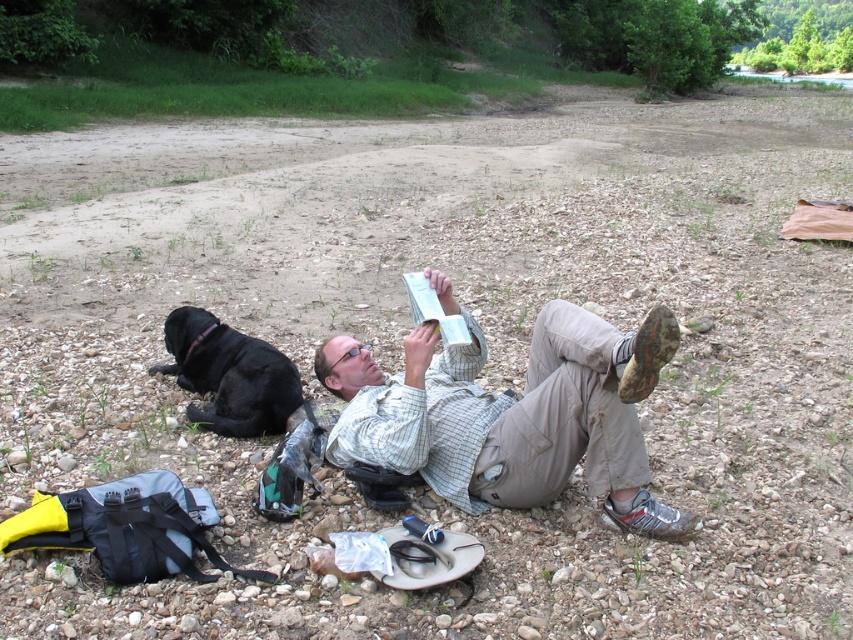
You are standing in the scene and want to pick up an item. Which of the two points, point (439, 298) or point (212, 356), is closer to you?

Point (439, 298) is closer to the viewer than point (212, 356).

Looking at this image, you are a photographer standing 10 feet away from the light brown cotton shirt at center and the black fur dog at lower left. You want to take a photo that includes both subjects in the frame. Given their distance apart, do you think you can fit both into the same photo without moving closer or farther away?

The light brown cotton shirt at center and the black fur dog at lower left are 27.53 inches apart. At a distance of 10 feet, this distance is likely within the camera frame, so yes, you can fit both subjects in the same photo without adjusting your position.

Based on the scene description, which object is taller between the light brown cotton shirt at center and the black fur dog at lower left?

The light brown cotton shirt at center is taller than the black fur dog at lower left.